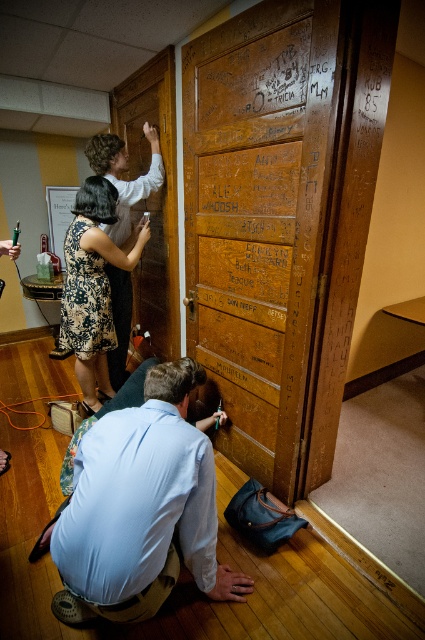
You are a painter holding a 20 inch wide painting. You want to place it between the wooden door at upper center and the floral dress at center. Is there enough space?

The distance between the wooden door at upper center and the floral dress at center is 19.30 inches. Since the painting is 20 inches wide, it won not fit in the space provided.